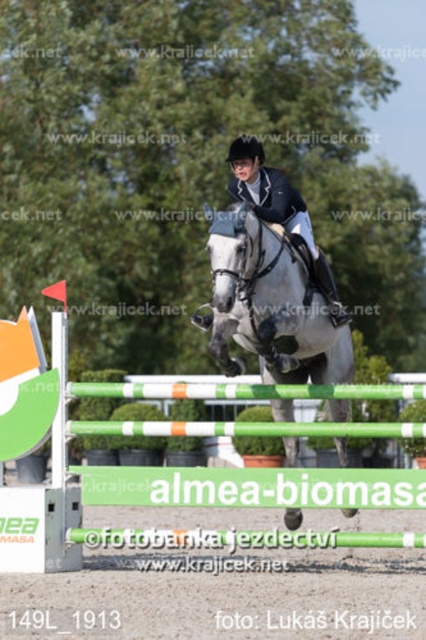
Question: Can you confirm if green plastic hurdle at center is positioned to the right of white glossy horse at center?

Choices:
 (A) no
 (B) yes

Answer: (A)

Question: Among these objects, which one is nearest to the camera?

Choices:
 (A) white glossy horse at center
 (B) green plastic hurdle at center

Answer: (A)

Question: Does green plastic hurdle at center lie in front of white glossy horse at center?

Choices:
 (A) yes
 (B) no

Answer: (B)

Question: Does green plastic hurdle at center appear on the left side of white glossy horse at center?

Choices:
 (A) yes
 (B) no

Answer: (A)